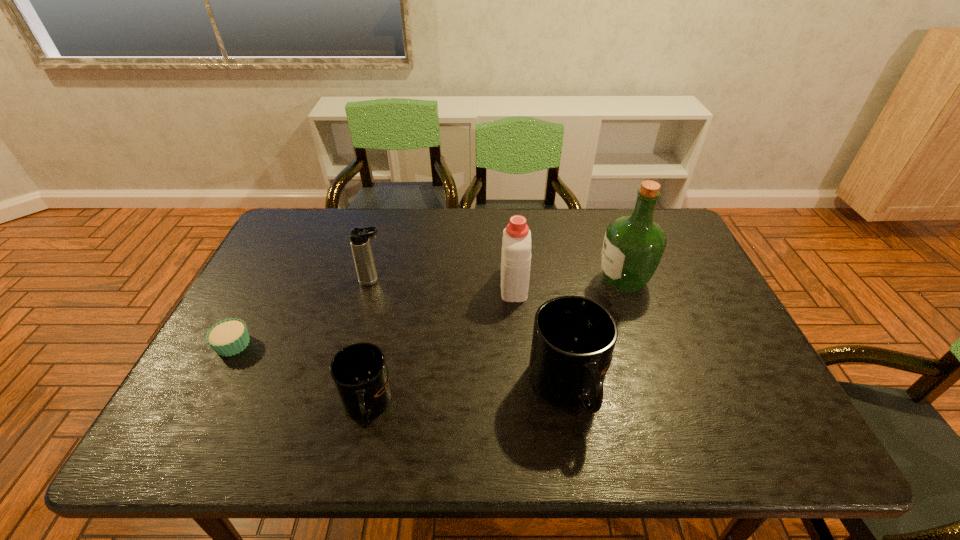
This screenshot has width=960, height=540. Find the location of `free space located 0.210m on the front-facing side of the tallest object`. free space located 0.210m on the front-facing side of the tallest object is located at coordinates (524, 281).

Locate an element on the screen. This screenshot has height=540, width=960. vacant space located 0.190m on the front-facing side of the tallest object is located at coordinates (531, 281).

Locate an element on the screen. The height and width of the screenshot is (540, 960). vacant area situated 0.100m on the front-facing side of the tallest object is located at coordinates (562, 281).

Locate an element on the screen. vacant space positioned on the handle side of the detergent is located at coordinates (509, 224).

At what (x,y) coordinates should I click in order to perform the action: click on free spot located 0.150m on the handle side of the detergent. Please return your answer as a coordinate pair (x, y). This screenshot has height=540, width=960. Looking at the image, I should click on (510, 237).

The width and height of the screenshot is (960, 540). Find the location of `vacant space located 0.130m on the handle side of the detergent`. vacant space located 0.130m on the handle side of the detergent is located at coordinates (510, 240).

Locate an element on the screen. The height and width of the screenshot is (540, 960). free space located on the back of the shortest object is located at coordinates (284, 247).

Image resolution: width=960 pixels, height=540 pixels. I want to click on object that is at the left edge, so click(228, 337).

The width and height of the screenshot is (960, 540). I want to click on vacant space at the far edge of the desktop, so click(x=581, y=235).

This screenshot has height=540, width=960. In the image, there is a desktop. In order to click on vacant space at the near edge in this screenshot , I will do `click(604, 401)`.